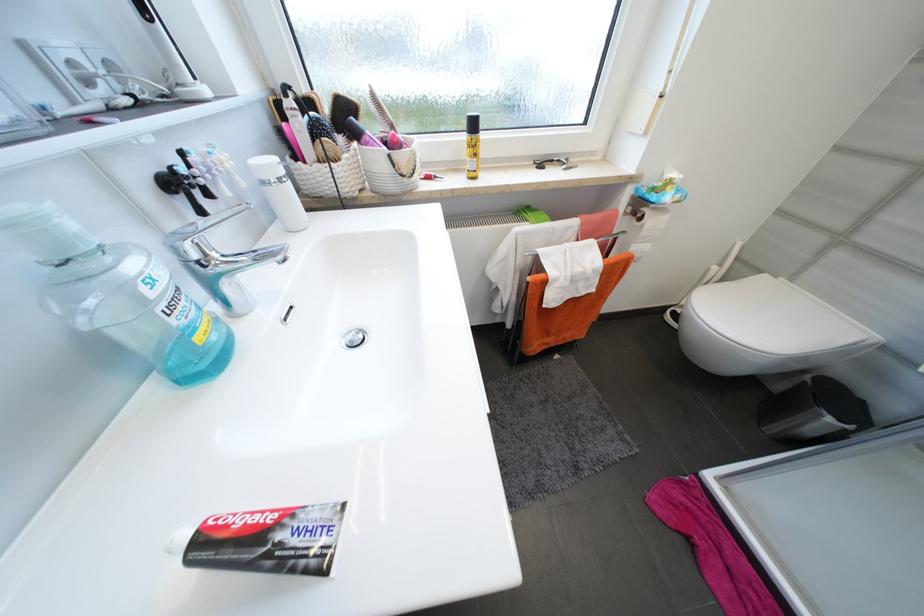
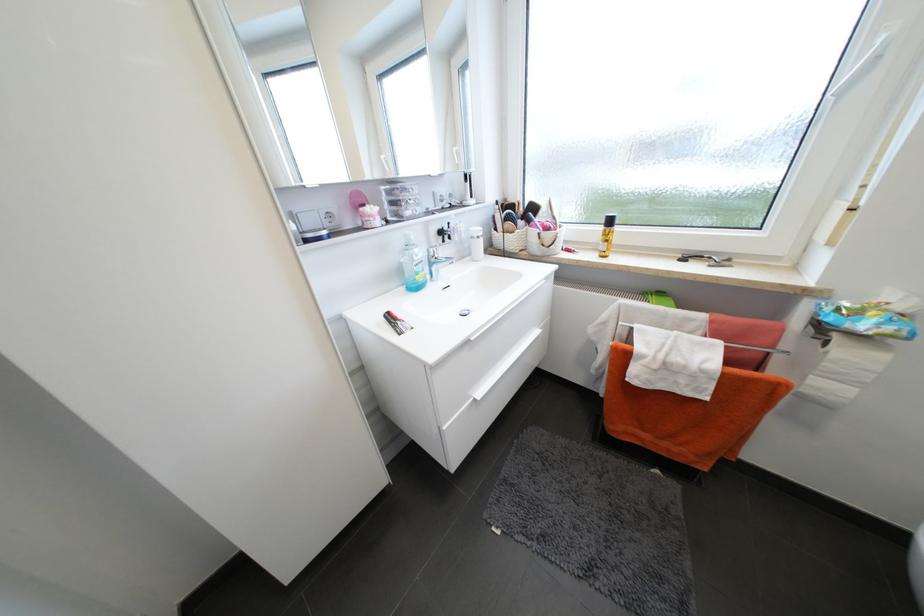
In the second image, find the point that corresponds to (285,537) in the first image.

(405, 323)